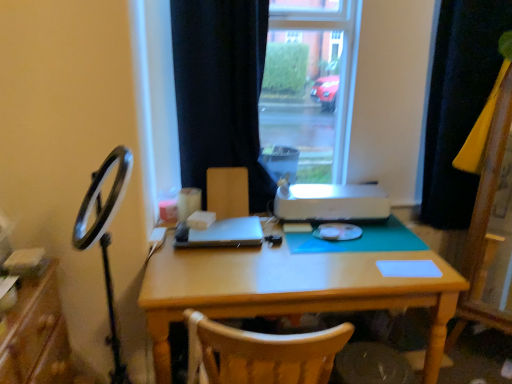
In order to click on free space on the front side of white plastic printer at center in this screenshot , I will do `click(337, 262)`.